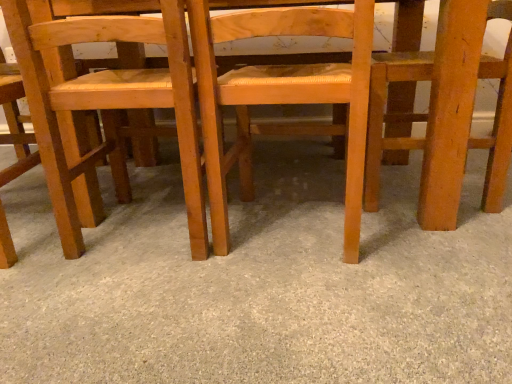
Question: Does point [x=141, y=380] appear closer or farther from the camera than point [x=74, y=139]?

Choices:
 (A) farther
 (B) closer

Answer: (B)

Question: In terms of height, does smooth beige carpet at center look taller or shorter compared to natural wood chair at center, marked as the 2th chair in a left-to-right arrangement?

Choices:
 (A) short
 (B) tall

Answer: (A)

Question: Based on their relative distances, which object is nearer to the light brown wood chair at center, which is counted as the third chair, starting from the left?

Choices:
 (A) light brown wood chair at left, the 4th chair viewed from the right
 (B) wooden chair at right, the fourth chair from the left
 (C) natural wood chair at center, marked as the 2th chair in a left-to-right arrangement
 (D) smooth beige carpet at center

Answer: (C)

Question: Estimate the real-world distances between objects in this image. Which object is closer to the light brown wood chair at center, which is counted as the third chair, starting from the left?

Choices:
 (A) smooth beige carpet at center
 (B) wooden chair at right, the fourth chair from the left
 (C) light brown wood chair at left, positioned as the first chair in left-to-right order
 (D) natural wood chair at center, the 3th chair viewed from the right

Answer: (D)